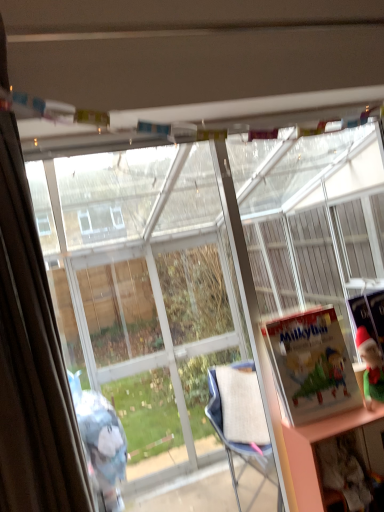
Question: Would you consider matte paper book at right, marked as the first book in a left-to-right arrangement, to be distant from matte green book at right, which appears as the first book when viewed from the back?

Choices:
 (A) yes
 (B) no

Answer: (B)

Question: Can you confirm if matte paper book at right, which is counted as the second book, starting from the back, is shorter than matte green book at right, which is counted as the 2th book, starting from the front?

Choices:
 (A) no
 (B) yes

Answer: (B)

Question: Can you confirm if matte paper book at right, the 2th book positioned from the right, is thinner than matte green book at right, which is the second book in left-to-right order?

Choices:
 (A) no
 (B) yes

Answer: (A)

Question: Is matte paper book at right, which is counted as the second book, starting from the back, completely or partially outside of matte green book at right, which appears as the 1th book when viewed from the right?

Choices:
 (A) yes
 (B) no

Answer: (A)

Question: Is matte paper book at right, placed as the first book when sorted from front to back, turned away from matte green book at right, which is the second book in left-to-right order?

Choices:
 (A) yes
 (B) no

Answer: (B)

Question: Is the position of matte paper book at right, the 2th book positioned from the right, less distant than that of matte green book at right, which is the second book in left-to-right order?

Choices:
 (A) yes
 (B) no

Answer: (A)

Question: Is matte green book at right, which appears as the 1th book when viewed from the right, bigger than matte paper book at right, the 2th book positioned from the right?

Choices:
 (A) yes
 (B) no

Answer: (B)

Question: Considering the relative positions of matte green book at right, which appears as the first book when viewed from the back, and matte paper book at right, marked as the first book in a left-to-right arrangement, in the image provided, is matte green book at right, which appears as the first book when viewed from the back, behind matte paper book at right, marked as the first book in a left-to-right arrangement,?

Choices:
 (A) yes
 (B) no

Answer: (A)

Question: Is matte green book at right, which is counted as the 2th book, starting from the front, looking in the opposite direction of matte paper book at right, placed as the first book when sorted from front to back?

Choices:
 (A) yes
 (B) no

Answer: (B)

Question: From a real-world perspective, does matte green book at right, which is counted as the 2th book, starting from the front, stand above matte paper book at right, the 2th book positioned from the right?

Choices:
 (A) no
 (B) yes

Answer: (A)

Question: Considering the relative positions of matte green book at right, which appears as the 1th book when viewed from the right, and matte paper book at right, which is counted as the second book, starting from the back, in the image provided, is matte green book at right, which appears as the 1th book when viewed from the right, to the right of matte paper book at right, which is counted as the second book, starting from the back, from the viewer's perspective?

Choices:
 (A) no
 (B) yes

Answer: (B)

Question: Would you say matte green book at right, which appears as the first book when viewed from the back, is outside matte paper book at right, marked as the first book in a left-to-right arrangement?

Choices:
 (A) yes
 (B) no

Answer: (A)

Question: Would you say matte green book at right, which appears as the first book when viewed from the back, contains transparent glass bay window at center?

Choices:
 (A) yes
 (B) no

Answer: (B)